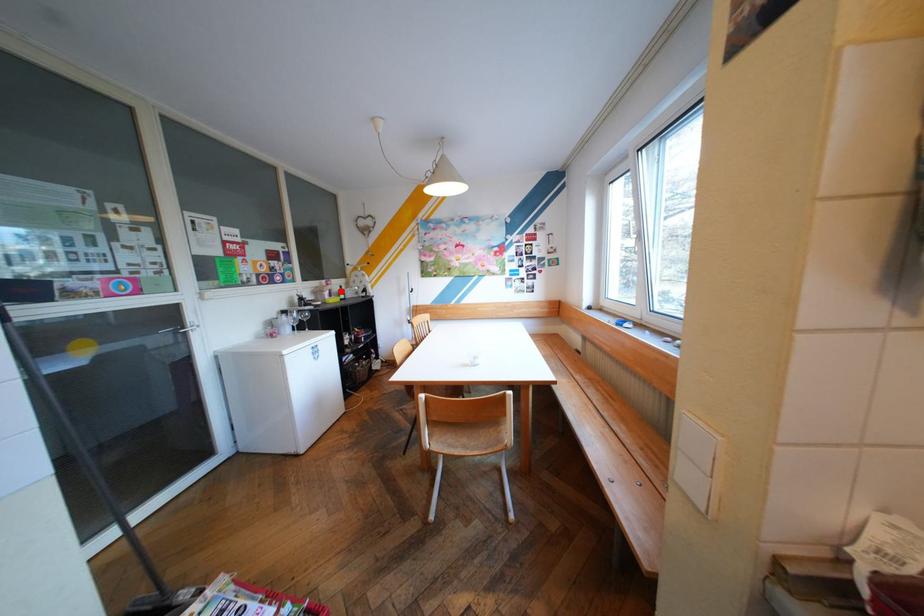
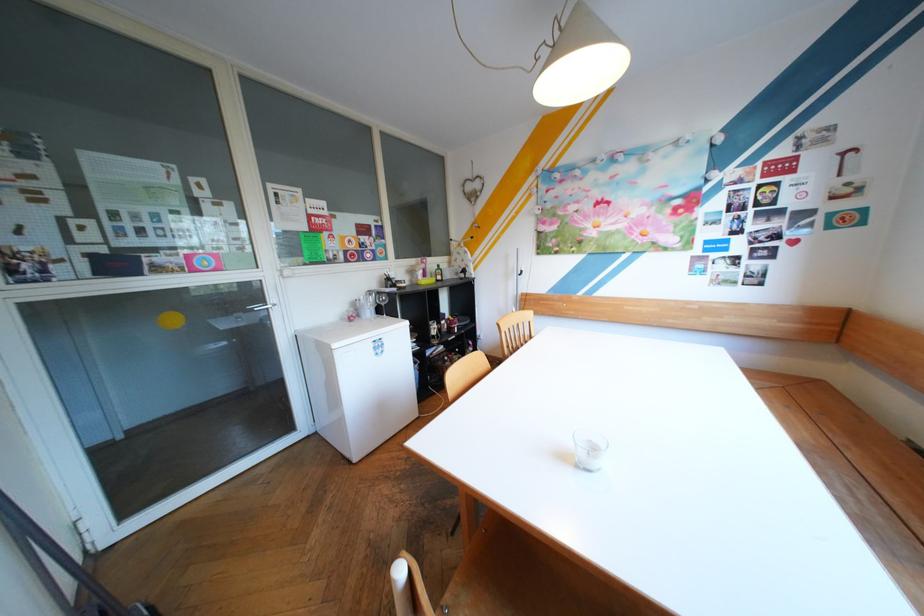
In the second image, find the point that corresponds to the highlighted location in the first image.

(434, 270)